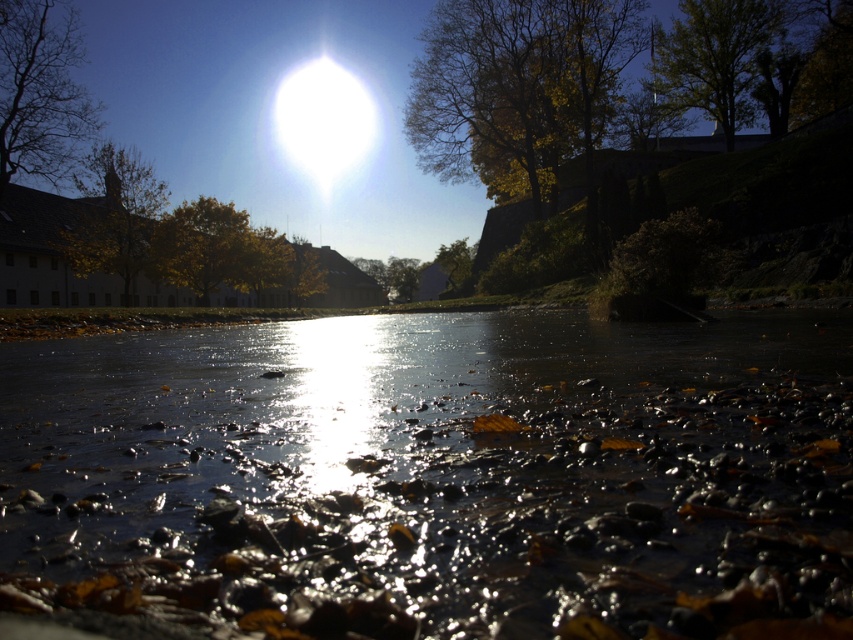
Question: Is yellow-green leaves at center above white glossy sun at upper center?

Choices:
 (A) yes
 (B) no

Answer: (B)

Question: Is yellow-green foliage at upper center closer to camera compared to white glossy sun at upper center?

Choices:
 (A) no
 (B) yes

Answer: (B)

Question: Which object appears closest to the camera in this image?

Choices:
 (A) yellow-green leaves at center
 (B) green leafy tree at upper right

Answer: (B)

Question: Is green leafy tree at upper right wider than white glossy sun at upper center?

Choices:
 (A) yes
 (B) no

Answer: (B)

Question: Estimate the real-world distances between objects in this image. Which object is closer to the yellow-green leaves at center?

Choices:
 (A) shiny reflective water at center
 (B) brown leafy tree at upper left

Answer: (B)

Question: Which object is positioned closest to the yellow-green foliage at upper center?

Choices:
 (A) green leafy tree at upper right
 (B) golden leafy tree at left

Answer: (A)